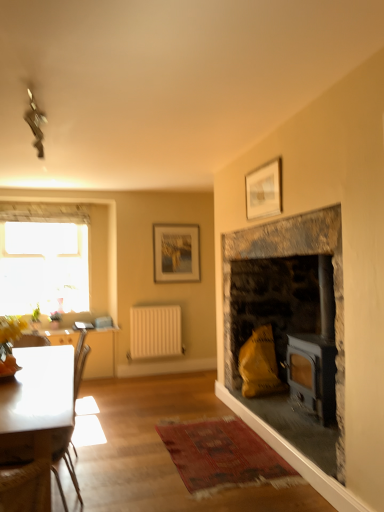
Question: Is transparent glass window at upper left behind stone fireplace at right?

Choices:
 (A) yes
 (B) no

Answer: (A)

Question: Can you confirm if transparent glass window at upper left is wider than stone fireplace at right?

Choices:
 (A) no
 (B) yes

Answer: (A)

Question: Does transparent glass window at upper left have a lesser height compared to stone fireplace at right?

Choices:
 (A) no
 (B) yes

Answer: (B)

Question: From a real-world perspective, is transparent glass window at upper left on top of stone fireplace at right?

Choices:
 (A) no
 (B) yes

Answer: (B)

Question: Can you confirm if transparent glass window at upper left is bigger than stone fireplace at right?

Choices:
 (A) yes
 (B) no

Answer: (B)

Question: From a real-world perspective, is transparent glass window at upper left located beneath stone fireplace at right?

Choices:
 (A) yes
 (B) no

Answer: (B)

Question: Is transparent glass window at upper left positioned with its back to white matte radiator at center?

Choices:
 (A) yes
 (B) no

Answer: (B)

Question: Considering the relative positions of transparent glass window at upper left and white matte radiator at center in the image provided, is transparent glass window at upper left to the left of white matte radiator at center from the viewer's perspective?

Choices:
 (A) yes
 (B) no

Answer: (A)

Question: Is transparent glass window at upper left facing towards white matte radiator at center?

Choices:
 (A) yes
 (B) no

Answer: (B)

Question: Can you confirm if transparent glass window at upper left is taller than white matte radiator at center?

Choices:
 (A) no
 (B) yes

Answer: (B)

Question: Can you confirm if transparent glass window at upper left is bigger than white matte radiator at center?

Choices:
 (A) yes
 (B) no

Answer: (A)

Question: Are transparent glass window at upper left and white matte radiator at center beside each other?

Choices:
 (A) no
 (B) yes

Answer: (A)

Question: From a real-world perspective, is transparent glass window at upper left located higher than white glossy coffee table at lower left?

Choices:
 (A) no
 (B) yes

Answer: (B)